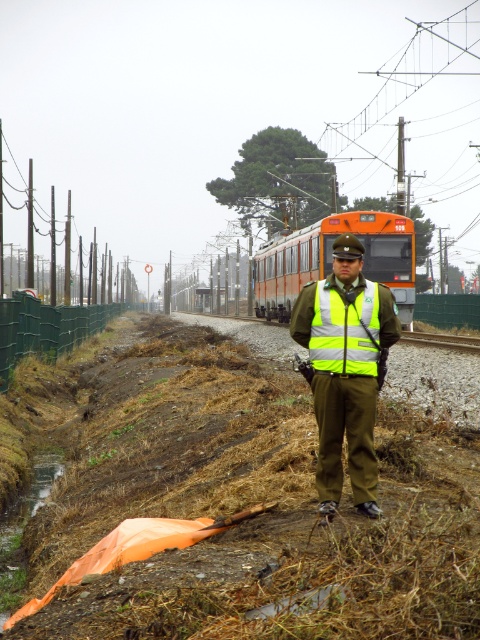
Is yellow reflective safety vest at center to the right of green plastic fence at left from the viewer's perspective?

Correct, you'll find yellow reflective safety vest at center to the right of green plastic fence at left.

Find the location of a particular element. yellow reflective safety vest at center is located at coordinates (346, 330).

Between green plastic fence at left and gravel train track at center, which one is positioned lower?

gravel train track at center is lower down.

Locate an element on the screen. green plastic fence at left is located at coordinates (46, 328).

Consider the image. Does yellow reflective safety vest at center appear under gravel train track at center?

Incorrect, yellow reflective safety vest at center is not positioned below gravel train track at center.

Is yellow reflective safety vest at center bigger than gravel train track at center?

No.

Measure the distance between yellow reflective safety vest at center and camera.

They are 5.13 meters apart.

Image resolution: width=480 pixels, height=640 pixels. I want to click on yellow reflective safety vest at center, so click(346, 330).